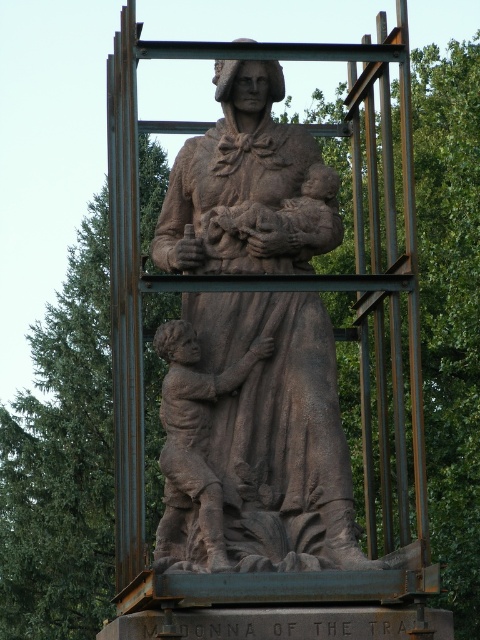
Question: Does brown stone statue at center lie behind brown stone child at lower left?

Choices:
 (A) no
 (B) yes

Answer: (B)

Question: Which point is farther from the camera taking this photo?

Choices:
 (A) (223, 248)
 (B) (183, 372)

Answer: (A)

Question: Which of the following is the farthest from the observer?

Choices:
 (A) brown stone statue at center
 (B) brown stone child at lower left

Answer: (A)

Question: Does brown stone statue at center have a greater width compared to brown stone child at lower left?

Choices:
 (A) no
 (B) yes

Answer: (B)

Question: Observing the image, what is the correct spatial positioning of brown stone statue at center in reference to brown stone child at lower left?

Choices:
 (A) right
 (B) left

Answer: (A)

Question: Among these objects, which one is nearest to the camera?

Choices:
 (A) brown stone statue at center
 (B) brown stone child at lower left

Answer: (B)